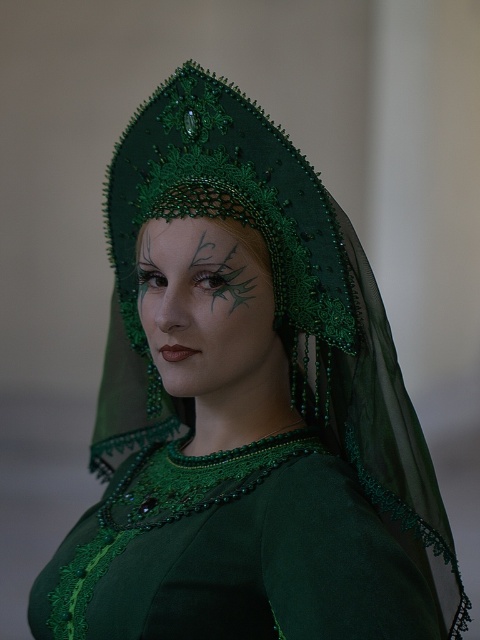
Can you confirm if matte green face at center is positioned to the left of matte green fabric at center?

In fact, matte green face at center is to the right of matte green fabric at center.

Between point (213, 298) and point (152, 225), which one is positioned in front?

Point (213, 298)

Where is `matte green face at center`? The width and height of the screenshot is (480, 640). matte green face at center is located at coordinates (212, 317).

Is green matte eyebrow at upper center wider than green matte/embroidered eyebrow at upper center?

Indeed, green matte eyebrow at upper center has a greater width compared to green matte/embroidered eyebrow at upper center.

Who is lower down, green matte eyebrow at upper center or green matte/embroidered eyebrow at upper center?

green matte eyebrow at upper center

This screenshot has height=640, width=480. In order to click on green matte eyebrow at upper center in this screenshot , I will do `click(202, 244)`.

Looking at this image, can you confirm if matte green fabric at center is thinner than green matte eyebrow at upper center?

No, matte green fabric at center is not thinner than green matte eyebrow at upper center.

Is point (141, 243) more distant than point (205, 272)?

Yes, point (141, 243) is behind point (205, 272).

Where is `matte green fabric at center`? matte green fabric at center is located at coordinates (186, 228).